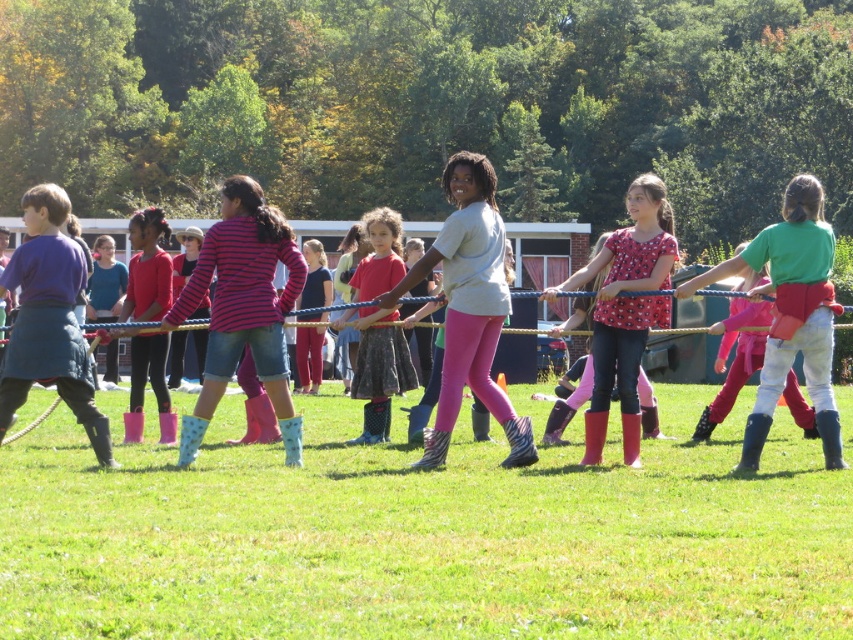
You are a photographer standing at the edge of the grassy field where the tug of war is happening. You want to take a photo of both the green rubber boots at center and the pink rubber boots at center. Which pair of boots will appear closer to the bottom of the photo?

The green rubber boots at center will appear closer to the bottom of the photo because it is located below the pink rubber boots at center.

You are a photographer standing at the edge of the grassy field where the tug of war is happening. You want to take a photo of the green rubber boots at center and the matte pink skirt at center in the same frame. The camera you have can capture objects within a 4 meter range. Will both objects be in the same photo?

The green rubber boots at center is 3.12 meters away from matte pink skirt at center. Since the distance between them is less than 4 meters, both objects will be in the same photo.

You are a photographer trying to capture the perfect shot of the green rubber boots at center during the tug of war. Where should you position yourself relative to the scene to ensure the boots are in the center of your photo?

To ensure the green rubber boots at center are in the center of your photo, you should position yourself directly facing the point at coordinates 0.492 on the horizontal axis and 0.928 on the vertical axis, which is where the boots are located.